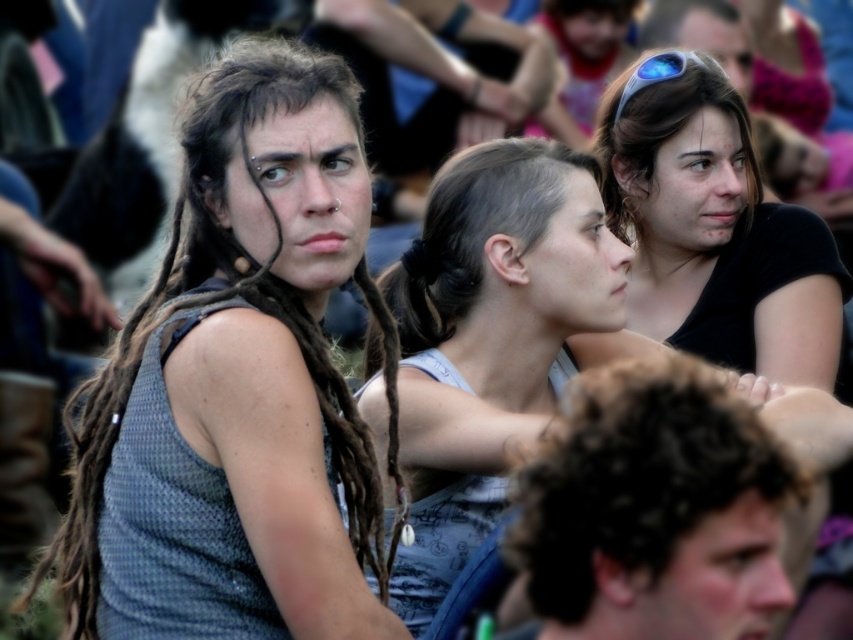
Looking at the group of people in the scene, which of the two individuals with light brown hair at center and dark curly hair at lower right is positioned more to the left side?

The light brown hair at center is positioned to the left of dark curly hair at lower right.

You are a photographer trying to capture a candid shot of the matte hair at center and dark curly hair at lower right. Since you can only focus on one person at a time, which person should you aim the camera at first to ensure both are in the frame?

You should aim the camera at the matte hair at center first because the dark curly hair at lower right is to the right of it, so by focusing on the matte hair at center, the dark curly hair at lower right will naturally be included in the frame to the right side.